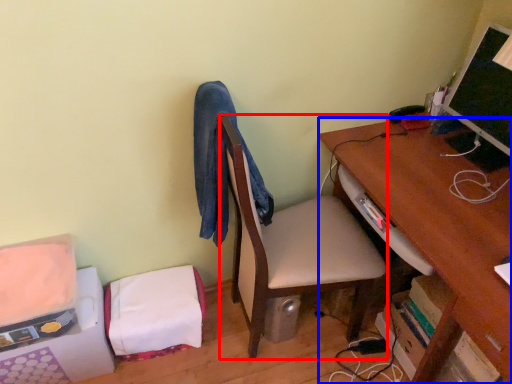
Question: Among these objects, which one is nearest to the camera, table (highlighted by a red box) or desk (highlighted by a blue box)?

Choices:
 (A) table
 (B) desk

Answer: (B)